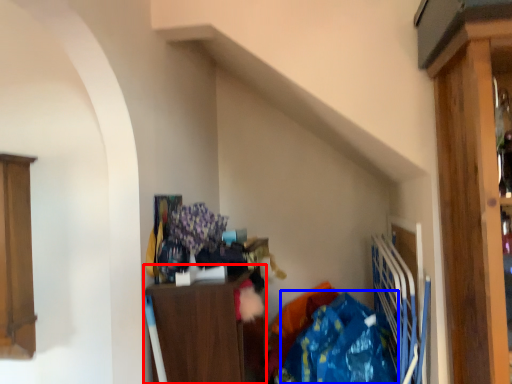
Question: Among these objects, which one is farthest to the camera, cabinetry (highlighted by a red box) or clothing (highlighted by a blue box)?

Choices:
 (A) cabinetry
 (B) clothing

Answer: (A)